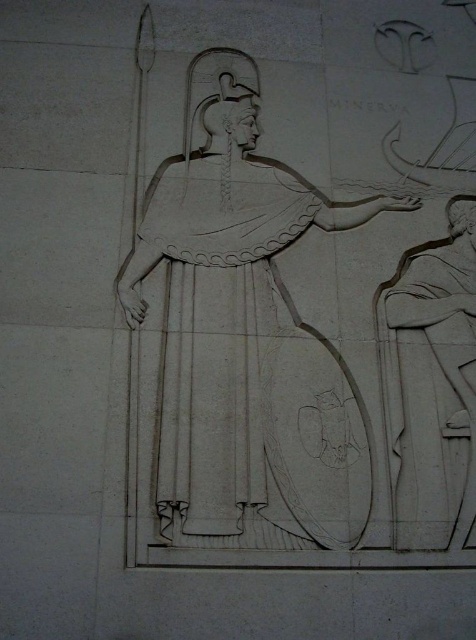
In the scene shown: You are an art conservator examining the bas relief sculpture. You need to determine if the white stone relief at center can be moved to a display case that can accommodate a maximum width of 1.2 meters. Given that the white stone figure at right is 0.8 meters wide, can the relief fit?

The white stone relief at center is wider than the white stone figure at right, which is 0.8 meters. Since the relief is larger in width, it may exceed the display case limit of 1.2 meters. However, without exact measurements, we cannot confirm. The conservator should measure the relief directly.

You are an art conservator examining the bas relief sculpture. You need to clean the white stone relief at center and the white stone figure at right. Which one should you clean first if you want to start with the part closest to you?

You should clean the white stone relief at center first because it is closer to the viewer than the white stone figure at right.